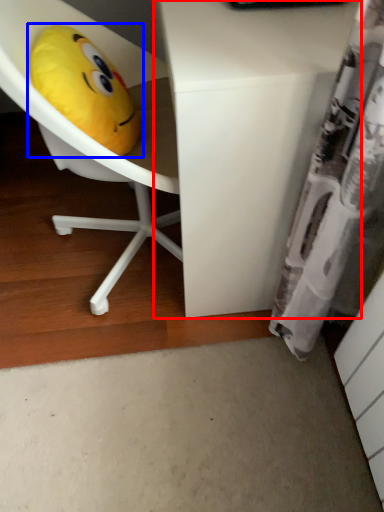
Question: Which point is further to the camera, desk (highlighted by a red box) or toy (highlighted by a blue box)?

Choices:
 (A) desk
 (B) toy

Answer: (B)